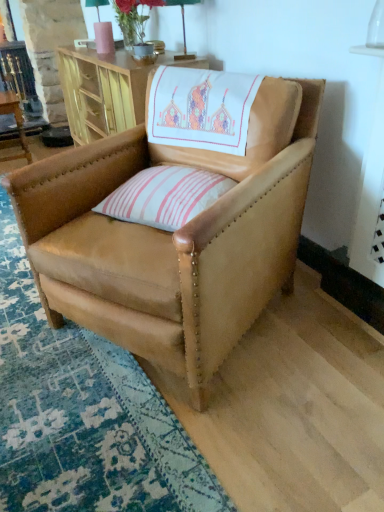
Question: From the image's perspective, is matte pink vase at upper center over pink striped cushion at center?

Choices:
 (A) yes
 (B) no

Answer: (A)

Question: Is matte pink vase at upper center beside pink striped cushion at center?

Choices:
 (A) yes
 (B) no

Answer: (B)

Question: Does matte pink vase at upper center appear on the right side of pink striped cushion at center?

Choices:
 (A) yes
 (B) no

Answer: (B)

Question: Is pink striped cushion at center a part of matte pink vase at upper center?

Choices:
 (A) no
 (B) yes

Answer: (A)

Question: Considering the relative sizes of matte pink vase at upper center and pink striped cushion at center in the image provided, is matte pink vase at upper center taller than pink striped cushion at center?

Choices:
 (A) yes
 (B) no

Answer: (A)

Question: From the image's perspective, is pink striped cushion at center above or below wooden table at left, arranged as the second table when viewed from the right?

Choices:
 (A) below
 (B) above

Answer: (A)

Question: In terms of height, does pink striped cushion at center look taller or shorter compared to wooden table at left, the 1th table from the left?

Choices:
 (A) tall
 (B) short

Answer: (B)

Question: Is point (135, 214) positioned closer to the camera than point (23, 134)?

Choices:
 (A) closer
 (B) farther

Answer: (A)

Question: In terms of width, does pink striped cushion at center look wider or thinner when compared to wooden table at left, the 1th table from the left?

Choices:
 (A) thin
 (B) wide

Answer: (B)

Question: Relative to wooden cabinet at upper center, the 1th table when ordered from right to left, is tan leather chair at center in front or behind?

Choices:
 (A) behind
 (B) front

Answer: (B)

Question: Does point (289, 117) appear closer or farther from the camera than point (130, 97)?

Choices:
 (A) closer
 (B) farther

Answer: (A)

Question: Looking at their shapes, would you say tan leather chair at center is wider or thinner than wooden cabinet at upper center, the 1th table when ordered from right to left?

Choices:
 (A) wide
 (B) thin

Answer: (A)

Question: From a real-world perspective, is tan leather chair at center above or below wooden cabinet at upper center, the 1th table when ordered from right to left?

Choices:
 (A) above
 (B) below

Answer: (B)

Question: Based on their positions, is wooden cabinet at upper center, which is the second table from left to right, located to the left or right of matte pink vase at upper center?

Choices:
 (A) left
 (B) right

Answer: (A)

Question: Is wooden cabinet at upper center, the 1th table when ordered from right to left, in front of or behind matte pink vase at upper center in the image?

Choices:
 (A) behind
 (B) front

Answer: (B)